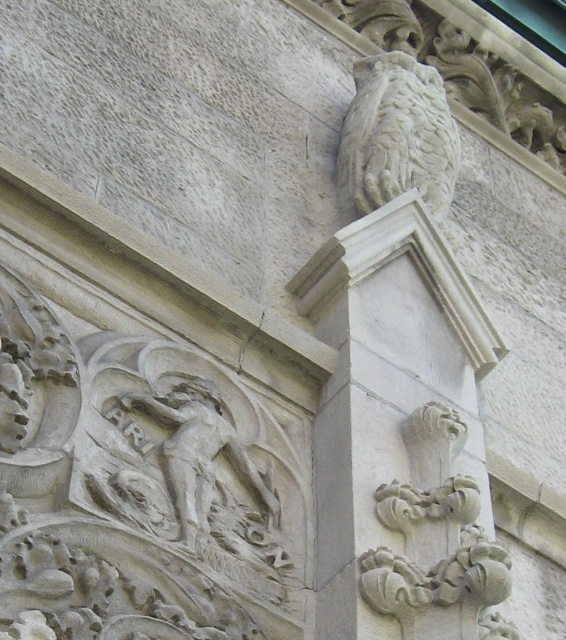
Question: Which point appears farthest from the camera in this image?

Choices:
 (A) (362, 115)
 (B) (177, 422)

Answer: (A)

Question: Which point is closer to the camera taking this photo?

Choices:
 (A) (387, 298)
 (B) (409, 182)

Answer: (A)

Question: Which object appears farthest from the camera in this image?

Choices:
 (A) white stone carving at center
 (B) white stone owl at upper right
 (C) carved stone figure at upper left
 (D) white stone column at upper right

Answer: (B)

Question: Observing the image, what is the correct spatial positioning of white stone carving at center in reference to carved stone figure at upper left?

Choices:
 (A) below
 (B) above

Answer: (A)

Question: Is white stone owl at upper right closer to the viewer compared to carved stone figure at upper left?

Choices:
 (A) yes
 (B) no

Answer: (B)

Question: Is white stone carving at center positioned behind carved stone figure at upper left?

Choices:
 (A) no
 (B) yes

Answer: (A)